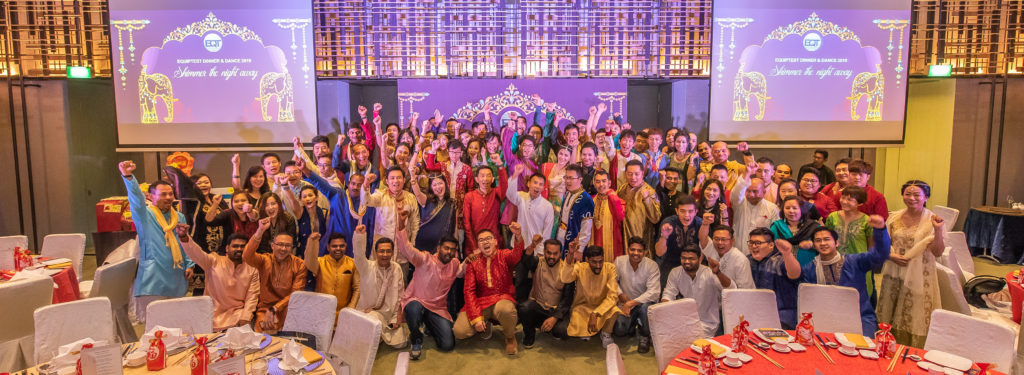
Where is `windows`? Image resolution: width=1024 pixels, height=375 pixels. windows is located at coordinates (75, 25), (391, 32), (643, 30), (980, 23).